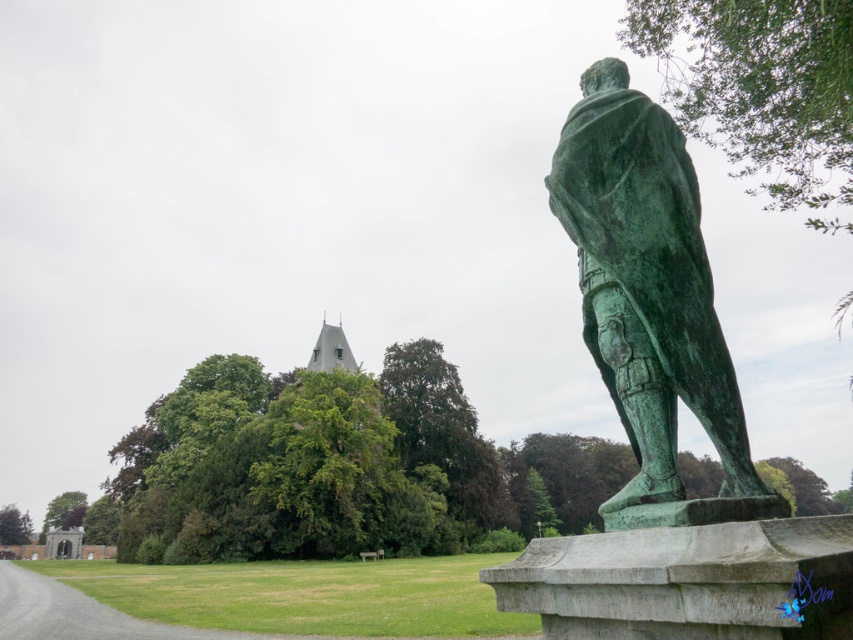
You are standing in front of the statue and want to walk towards the small castle or tower in the background. Which of the two points, point [593,65] or point [345,369], would you encounter first on your path?

You would encounter point [593,65] first because it is closer to the viewer than point [345,369].

You are standing at the center of the image and want to locate the green patina statue at right. According to the coordinates provided, in which direction should you move to face the statue?

The green patina statue at right is located at coordinates point [650,300]. Since you are at the center, moving towards the right and downward direction would align you with the statue.